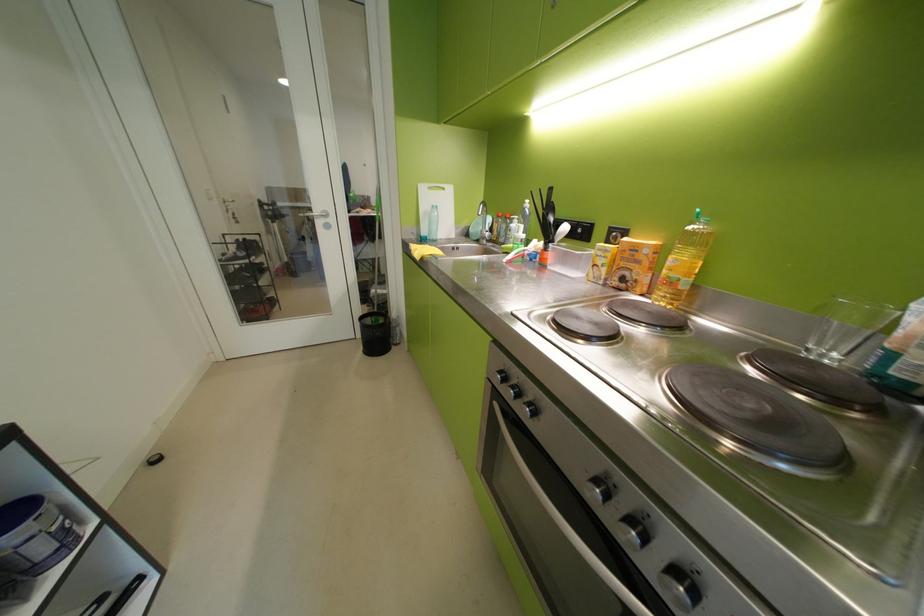
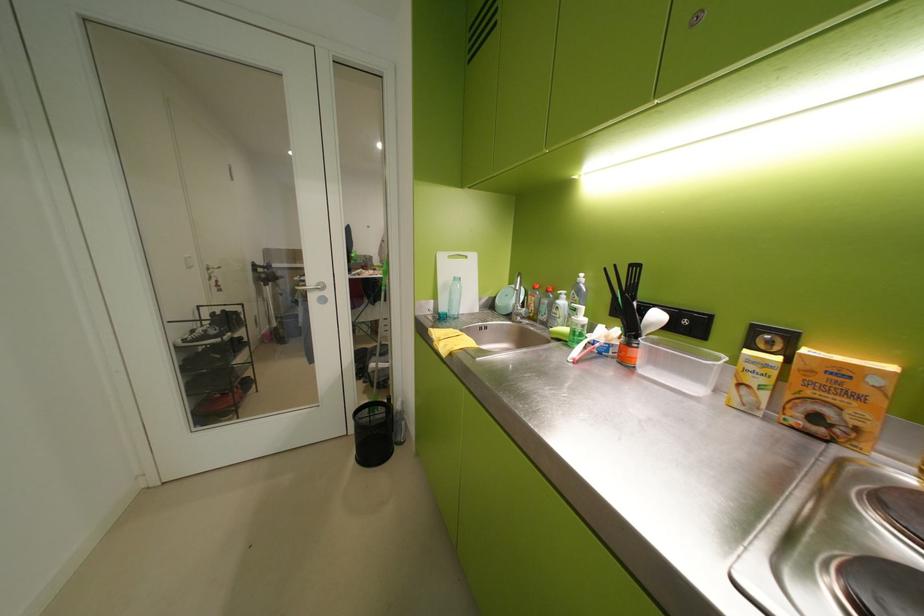
The point at (493, 238) is marked in the first image. Where is the corresponding point in the second image?

(529, 315)